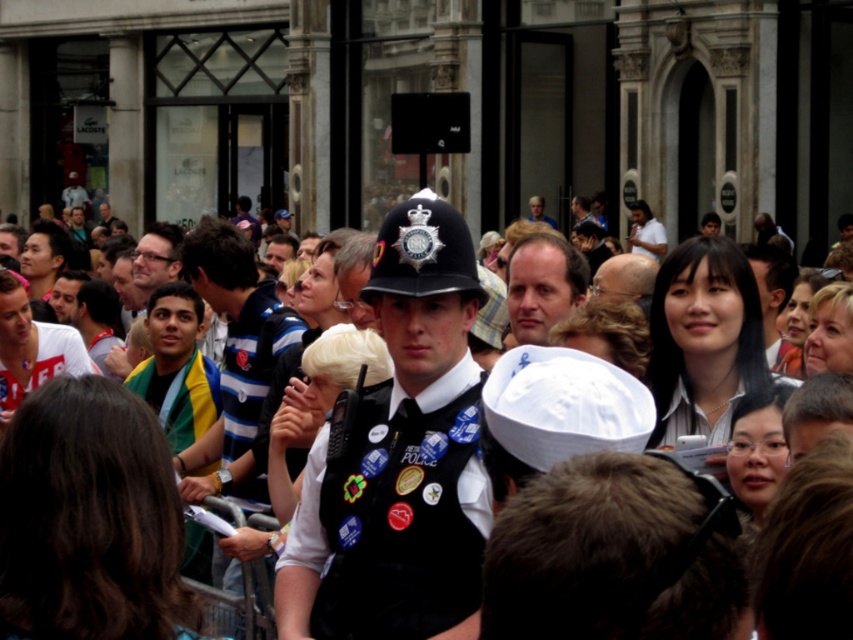
You are a photographer trying to capture a clear shot of the light brown hair at center and the black uniform at center from above. Which object should you focus on first to ensure both are in frame?

The black uniform at center is positioned under light brown hair at center, so you should focus on the light brown hair at center first to ensure both are in frame.

You are a photographer trying to capture a shot of the light brown hair at center without including the black uniform at center in the frame. Based on their positions, is this possible?

The black uniform at center is to the left of light brown hair at center, so if you position your camera to the right side of the black uniform at center, you can capture the light brown hair at center without including the black uniform at center in the frame.

You are a photographer positioned at the scene. You want to capture a clear photo of the black uniform at center without including any people in the background. Given that your camera has a maximum zoom range of 100 meters, can you achieve this? Please explain your reasoning.

The black uniform at center is 36.49 meters away from the viewer. Since the camera can zoom up to 100 meters, it is within the camera range. However, the crowd behind the officer may still appear in the photo depending on the zoom level and angle. To exclude the background crowd, adjust the zoom to focus tightly on the black uniform at center, ensuring the frame excludes the surrounding people.